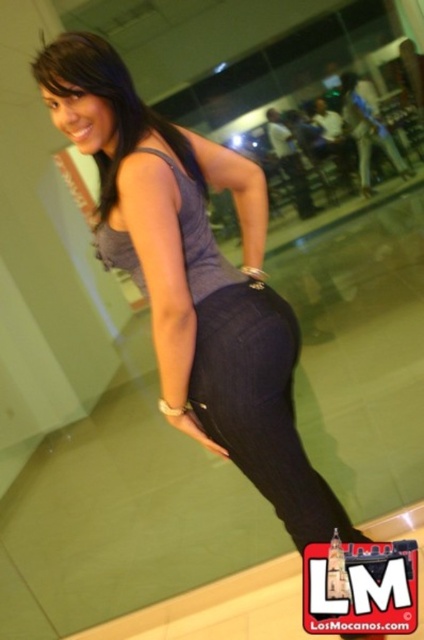
You are an interior designer working on a project and need to place a decorative item exactly at the position where the matte purple tank top at upper center is located. What are the coordinates of that position?

The coordinates of the position where the matte purple tank top at upper center is located are at point (108, 104).

You are a photographer trying to capture the woman in the scene. If you focus on the matte gray tank top at center, will it block your view of the matte gray tank top at upper center?

The matte gray tank top at center is in front of the matte gray tank top at upper center, so focusing on the matte gray tank top at center will block the view of the matte gray tank top at upper center.

You are standing in the lounge area and notice a point marked at coordinates [108,104]. Based on the scene, what object is this point located on?

The point at coordinates [108,104] is located on the matte purple tank top at upper center.